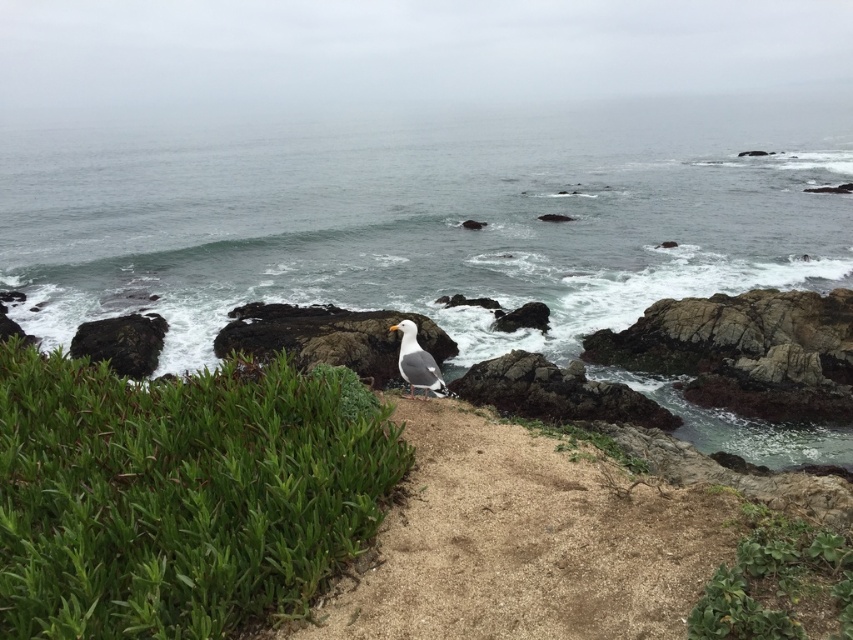
Between clear water at center and green leafy plant at lower right, which one has more height?

With more height is clear water at center.

Who is positioned more to the right, clear water at center or green leafy plant at lower right?

From the viewer's perspective, green leafy plant at lower right appears more on the right side.

At what (x,y) coordinates should I click in order to perform the action: click on clear water at center. Please return your answer as a coordinate pair (x, y). Looking at the image, I should click on (424, 218).

The width and height of the screenshot is (853, 640). I want to click on clear water at center, so click(x=424, y=218).

Describe the element at coordinates (178, 493) in the screenshot. I see `green leafy shrub at center` at that location.

Can you confirm if green leafy shrub at center is wider than green leafy plant at lower right?

Correct, the width of green leafy shrub at center exceeds that of green leafy plant at lower right.

Describe the element at coordinates (178, 493) in the screenshot. I see `green leafy shrub at center` at that location.

Where is `green leafy shrub at center`? Image resolution: width=853 pixels, height=640 pixels. green leafy shrub at center is located at coordinates (178, 493).

Does green leafy shrub at center lie behind white feathered bird at center?

No, it is in front of white feathered bird at center.

Which is in front, point (76, 556) or point (415, 326)?

Point (76, 556) is more forward.

This screenshot has height=640, width=853. Identify the location of green leafy shrub at center. (178, 493).